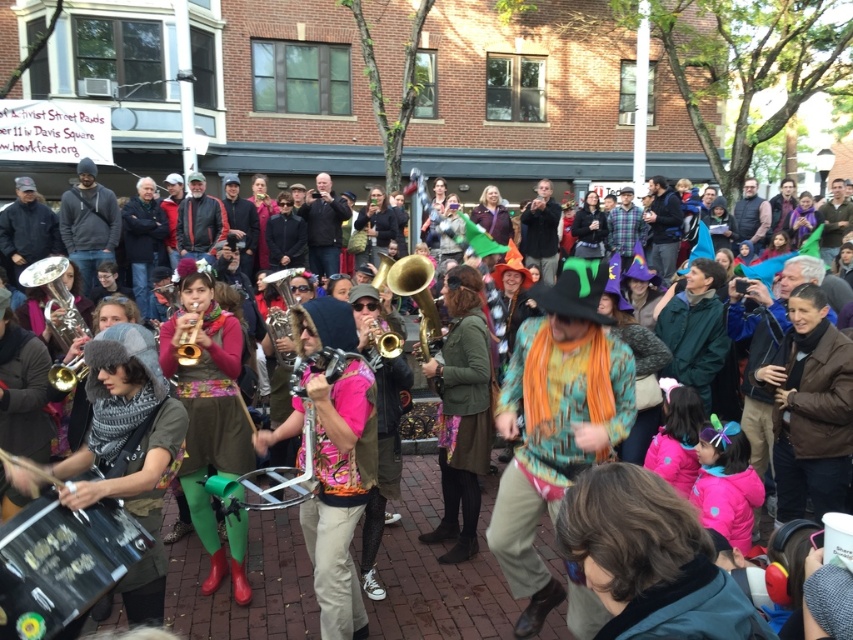
You are standing at the entrance of Davis Square and want to find the person wearing the matte green leggings at center. According to the coordinates provided, where should you look in the image?

The person wearing the matte green leggings at center is located at coordinates point (x=207, y=404) in the image.

You are a photographer at the Davis Square festival. You want to capture a photo of the shiny silver trumpet at left and the person wearing the matte green leggings at center. Based on their positions, which object should you focus on first to ensure both are in the frame?

The matte green leggings at center is located below the shiny silver trumpet at left, so you should focus on the shiny silver trumpet at left first to ensure both are in the frame.